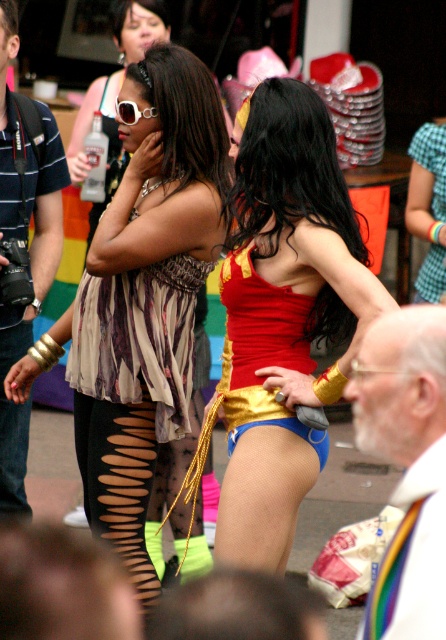
Question: Estimate the real-world distances between objects in this image. Which object is closer to the shiny gold bikini at center?

Choices:
 (A) matte brown dress at center
 (B) black mesh tights at lower left

Answer: (A)

Question: Is white hair at upper right below matte black camera at left?

Choices:
 (A) yes
 (B) no

Answer: (A)

Question: Is shiny red fabric at center positioned behind white hair at upper right?

Choices:
 (A) yes
 (B) no

Answer: (A)

Question: Which point appears farthest from the camera in this image?

Choices:
 (A) (83, 413)
 (B) (185, 420)

Answer: (B)

Question: Does matte brown dress at center appear on the left side of matte black camera at left?

Choices:
 (A) yes
 (B) no

Answer: (B)

Question: Based on their relative distances, which object is nearer to the matte black camera at left?

Choices:
 (A) black mesh tights at lower left
 (B) matte brown dress at center
 (C) shiny gold bikini at center
 (D) shiny red fabric at center

Answer: (A)